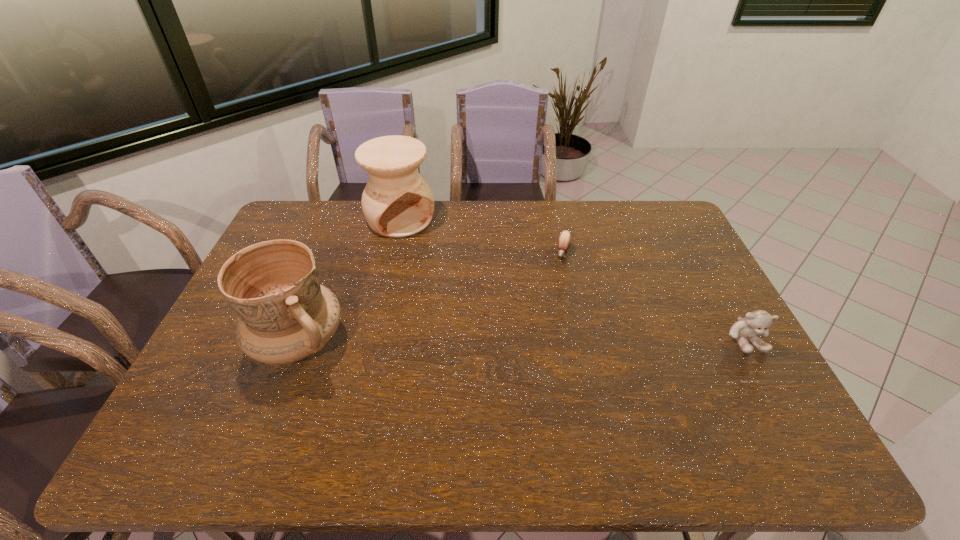
Identify the location of free point between the farthest object and the nearer pottery. This screenshot has height=540, width=960. (349, 280).

You are a GUI agent. You are given a task and a screenshot of the screen. Output one action in this format:
    pyautogui.click(x=<x>, y=<y>)
    Task: Click on the empty space between the escargot and the third tallest object
    Image resolution: width=960 pixels, height=540 pixels.
    Given the screenshot: What is the action you would take?
    coord(654,296)

Locate an element on the screen. vacant area that lies between the teddy bear and the nearer pottery is located at coordinates (522, 341).

Find the location of `object that is the closest to the third nearest object`. object that is the closest to the third nearest object is located at coordinates (397, 202).

Locate which object is the second closest to the nearer pottery. Please provide its 2D coordinates. Your answer should be formatted as a tuple, i.e. [(x, y)], where the tuple contains the x and y coordinates of a point satisfying the conditions above.

[(564, 240)]

I want to click on vacant space that satisfies the following two spatial constraints: 1. on the back side of the nearer pottery; 2. on the right side of the shortest object, so click(x=332, y=253).